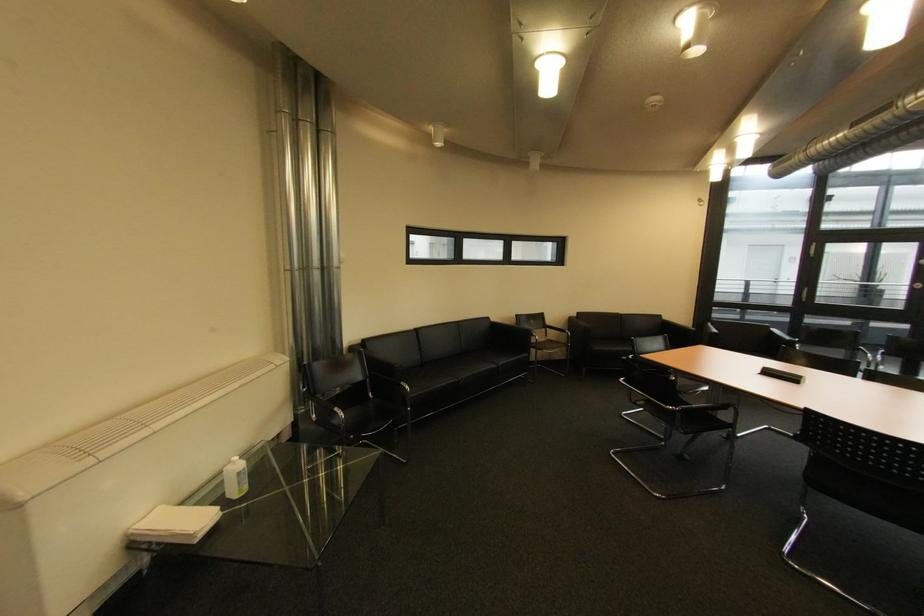
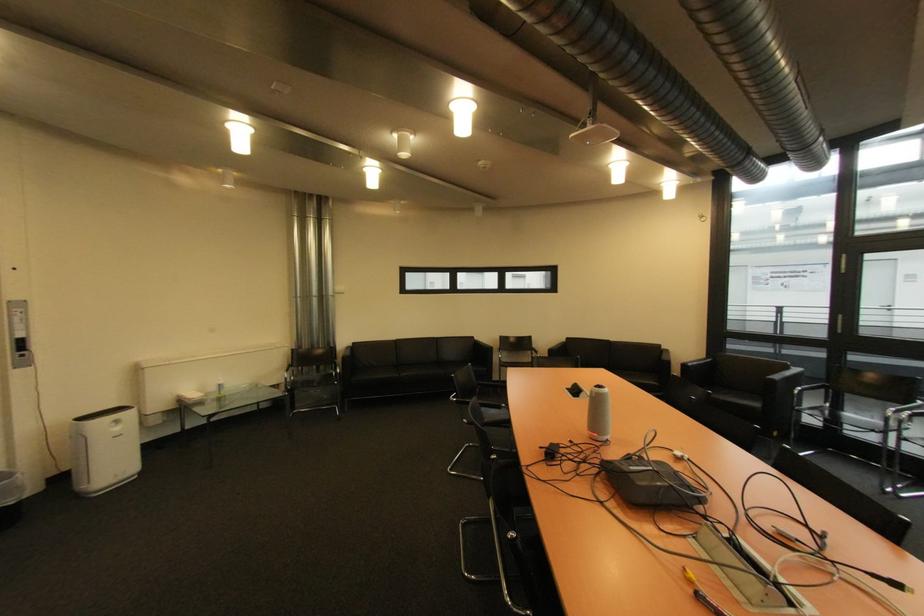
Find the pixel in the second image that matches [767,373] in the first image.

(578, 389)